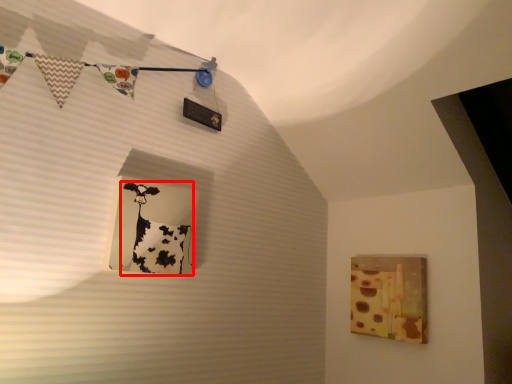
Question: In this image, where is art (annotated by the red box) located relative to picture frame?

Choices:
 (A) right
 (B) left

Answer: (B)